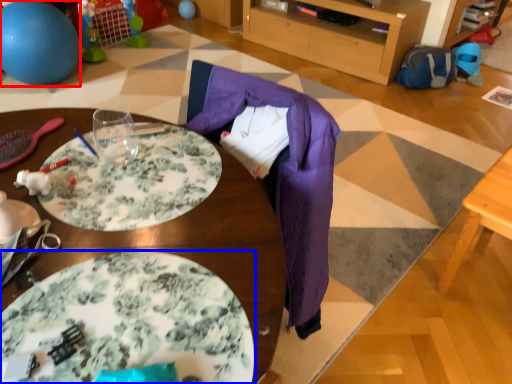
Question: Which object is further to the camera taking this photo, ball (highlighted by a red box) or plate (highlighted by a blue box)?

Choices:
 (A) ball
 (B) plate

Answer: (A)